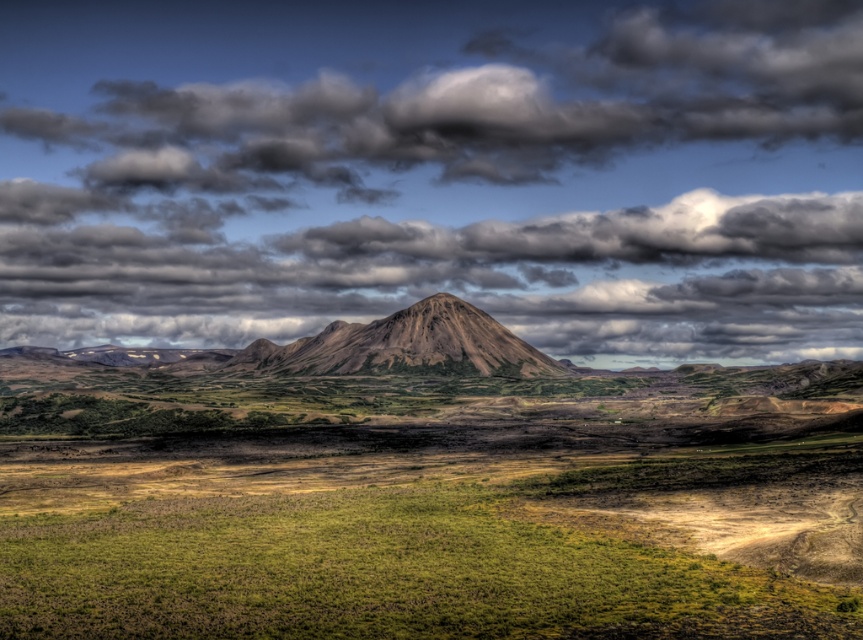
Consider the image. Can you confirm if cloudy sky at upper center is wider than green grassy field at lower center?

Indeed, cloudy sky at upper center has a greater width compared to green grassy field at lower center.

Can you confirm if cloudy sky at upper center is positioned below green grassy field at lower center?

Incorrect, cloudy sky at upper center is not positioned below green grassy field at lower center.

The width and height of the screenshot is (863, 640). What do you see at coordinates (435, 172) in the screenshot?
I see `cloudy sky at upper center` at bounding box center [435, 172].

This screenshot has width=863, height=640. Identify the location of cloudy sky at upper center. (435, 172).

Who is higher up, green grassy field at lower center or brown textured mountain at center?

green grassy field at lower center is higher up.

Which is in front, point (690, 592) or point (435, 362)?

Point (690, 592) is more forward.

Between point (427, 548) and point (408, 336), which one is positioned in front?

Point (427, 548) is in front.

Where is `green grassy field at lower center`? The height and width of the screenshot is (640, 863). green grassy field at lower center is located at coordinates (379, 573).

Is cloudy sky at upper center positioned at the back of brown textured mountain at center?

Yes, it is.

Who is positioned more to the right, cloudy sky at upper center or brown textured mountain at center?

brown textured mountain at center

Is point (300, 246) farther from camera compared to point (526, 342)?

Yes, it is behind point (526, 342).

Locate an element on the screen. cloudy sky at upper center is located at coordinates (435, 172).